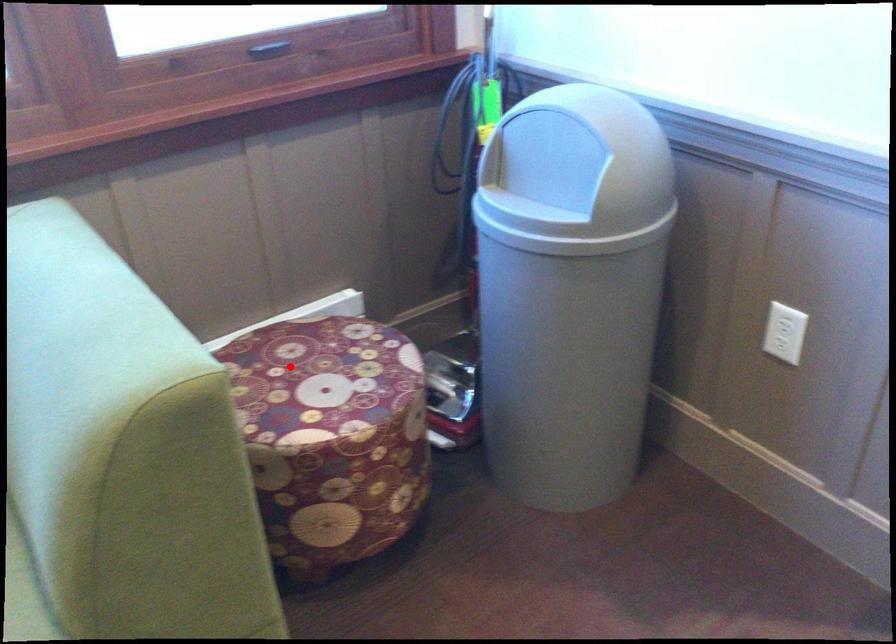
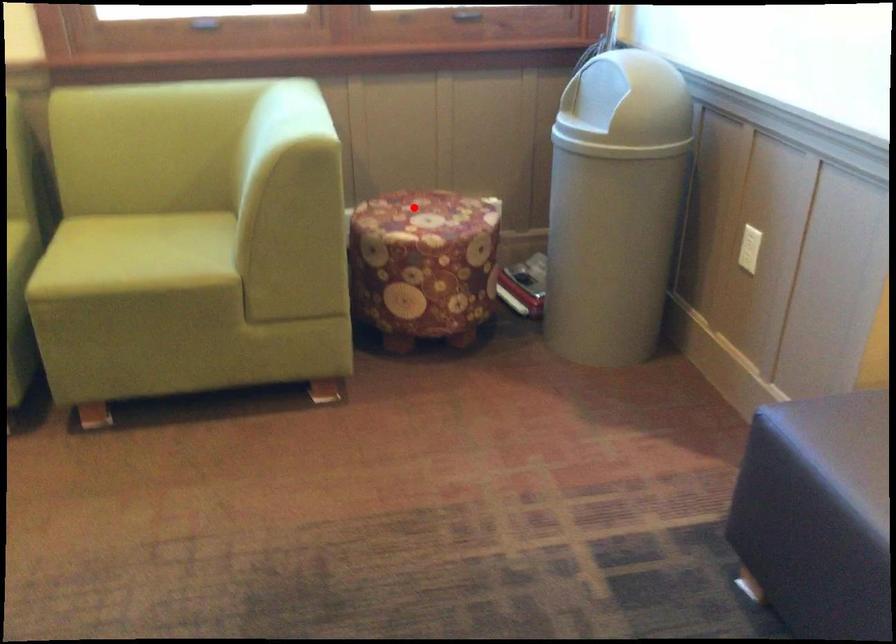
I am providing you with two images of the same scene from different viewpoints. A red point is marked on the first image and another point is marked on the second image. Is the red point in image1 aligned with the point shown in image2?

Yes